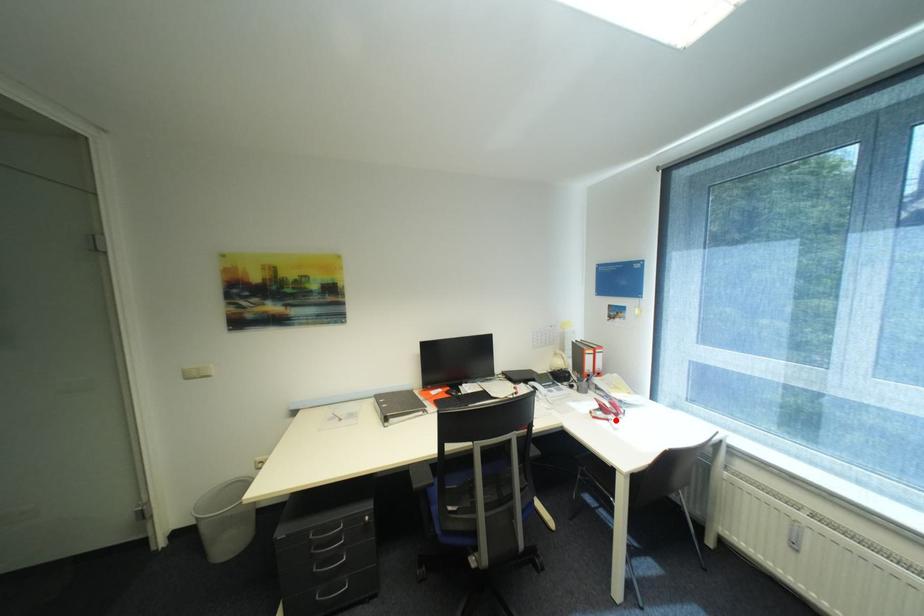
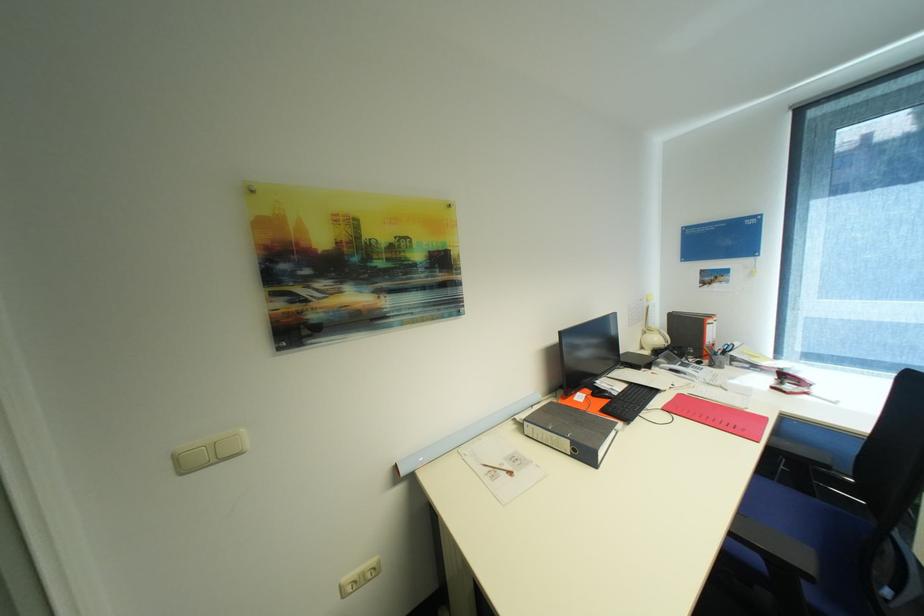
In the second image, find the point that corresponds to the highlighted location in the first image.

(813, 394)